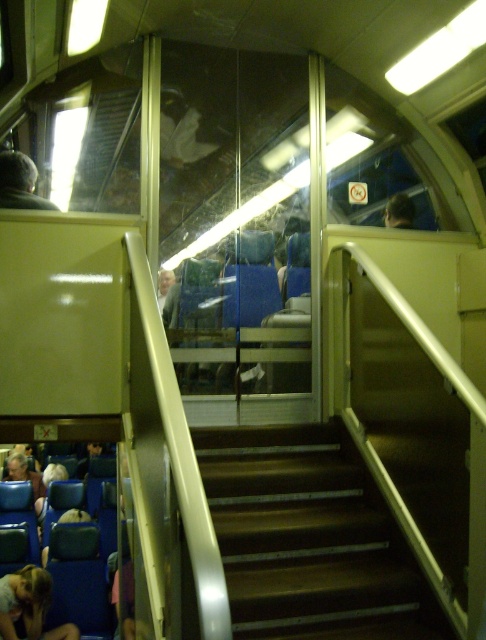
Is light brown fabric person at lower left positioned at the back of light brown leather jacket at lower left?

No, it is not.

Is light brown fabric person at lower left below light brown leather jacket at lower left?

Yes.

Is point (27, 614) more distant than point (3, 477)?

No.

Find the location of a particular element. Image resolution: width=486 pixels, height=640 pixels. light brown fabric person at lower left is located at coordinates (29, 605).

Measure the distance between dark hair at upper left and light brown leather jacket at lower left.

The distance of dark hair at upper left from light brown leather jacket at lower left is 4.72 meters.

At what (x,y) coordinates should I click in order to perform the action: click on dark hair at upper left. Please return your answer as a coordinate pair (x, y). This screenshot has height=640, width=486. Looking at the image, I should click on (19, 182).

Does point (11, 193) come in front of point (21, 460)?

That is True.

The width and height of the screenshot is (486, 640). Identify the location of dark hair at upper left. (19, 182).

Who is taller, metallic brown stairs at center or light brown fabric person at lower left?

metallic brown stairs at center is taller.

Measure the distance between metallic brown stairs at center and camera.

metallic brown stairs at center and camera are 2.97 meters apart from each other.

You are a GUI agent. You are given a task and a screenshot of the screen. Output one action in this format:
    pyautogui.click(x=<x>, y=<y>)
    Task: Click on the metallic brown stairs at center
    The width and height of the screenshot is (486, 640).
    Given the screenshot: What is the action you would take?
    pyautogui.click(x=309, y=538)